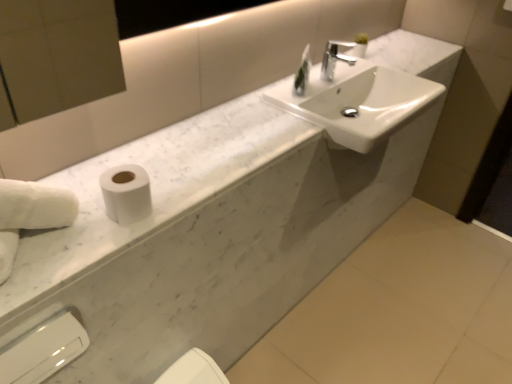
Find the location of a particular element. unoccupied space behind white matte toilet paper at left is located at coordinates (155, 164).